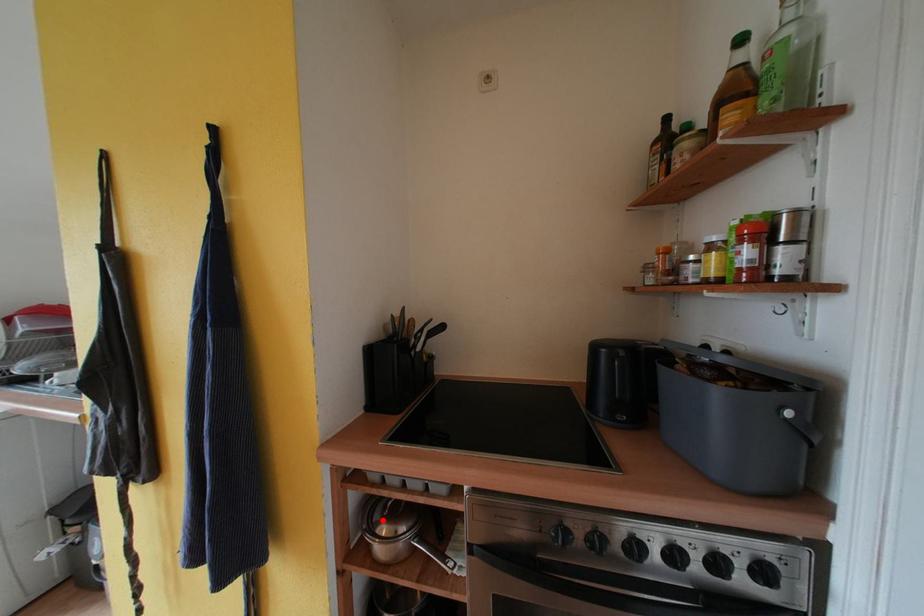
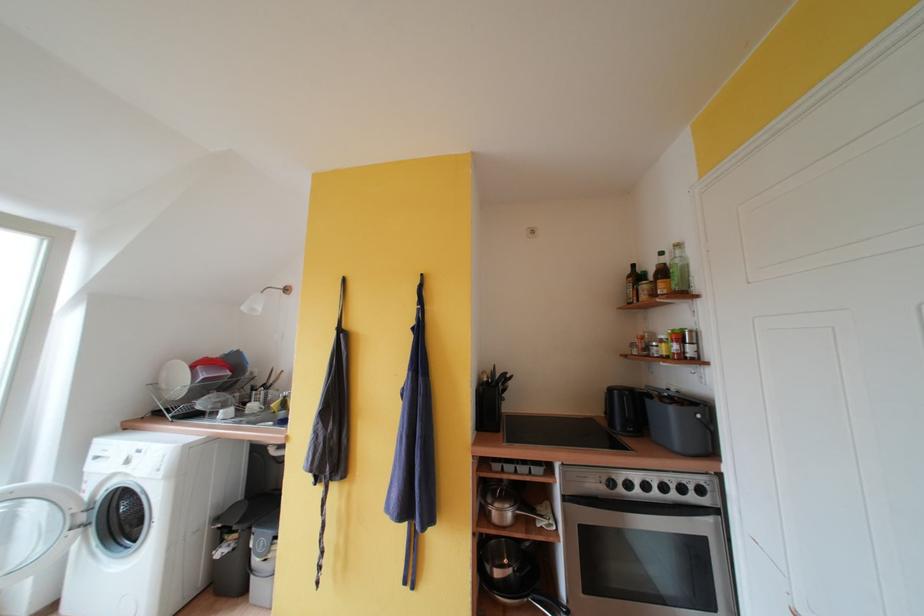
Find the pixel in the second image that matches the highlighted location in the first image.

(495, 504)